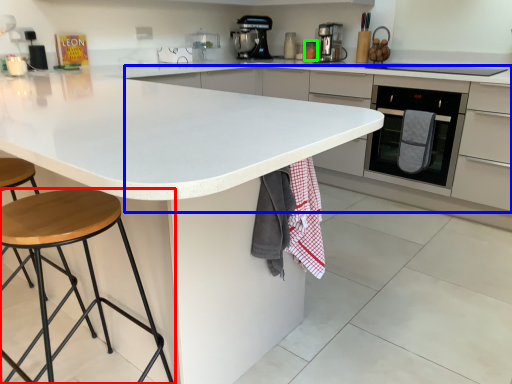
Question: Estimate the real-world distances between objects in this image. Which object is farther from stool (highlighted by a red box), cabinetry (highlighted by a blue box) or appliance (highlighted by a green box)?

Choices:
 (A) cabinetry
 (B) appliance

Answer: (B)